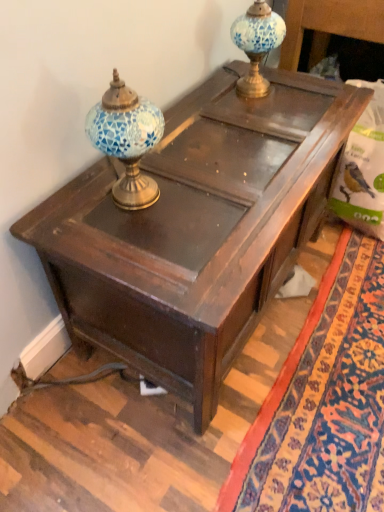
Question: Based on their positions, is wooden table at center located to the left or right of blue mosaic glass lamp at upper center, acting as the 2th candle holder starting from the bottom?

Choices:
 (A) left
 (B) right

Answer: (A)

Question: Is point (269, 118) positioned closer to the camera than point (258, 60)?

Choices:
 (A) closer
 (B) farther

Answer: (A)

Question: Estimate the real-world distances between objects in this image. Which object is closer to the blue mosaic glass lamp at upper center, the first candle holder when ordered from right to left?

Choices:
 (A) blue mosaic glass lamp at upper left, which is counted as the 2th candle holder, starting from the right
 (B) wooden table at center

Answer: (B)

Question: Considering the real-world distances, which object is farthest from the blue mosaic glass lamp at upper left, which is counted as the 2th candle holder, starting from the right?

Choices:
 (A) wooden table at center
 (B) blue mosaic glass lamp at upper center, the first candle holder when ordered from right to left

Answer: (B)